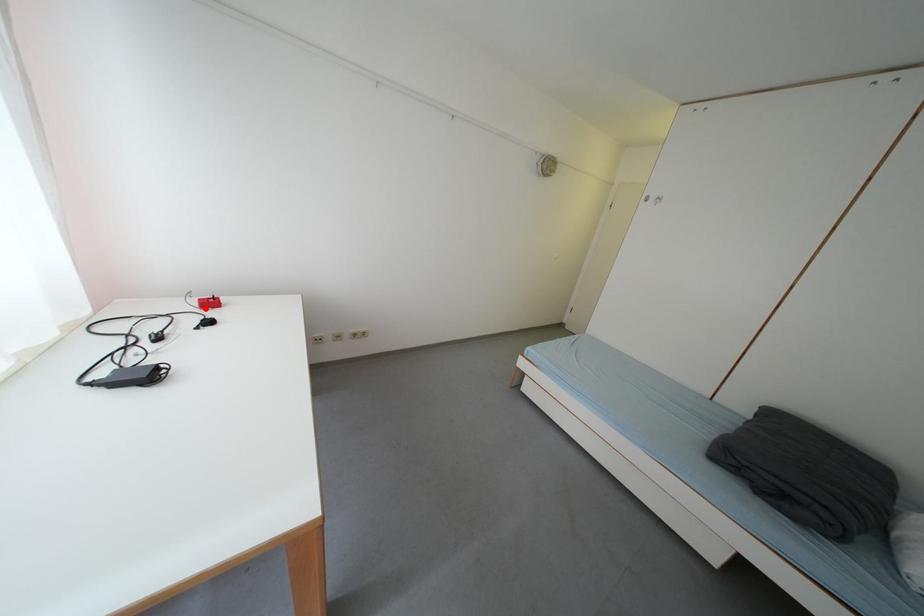
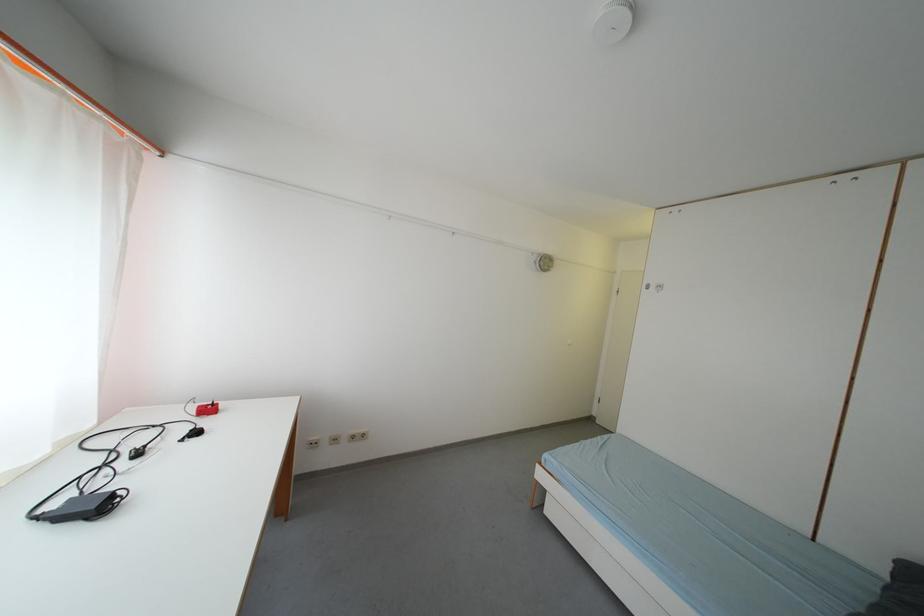
Locate, in the second image, the point that corresponds to the highlighted location in the first image.

(202, 416)